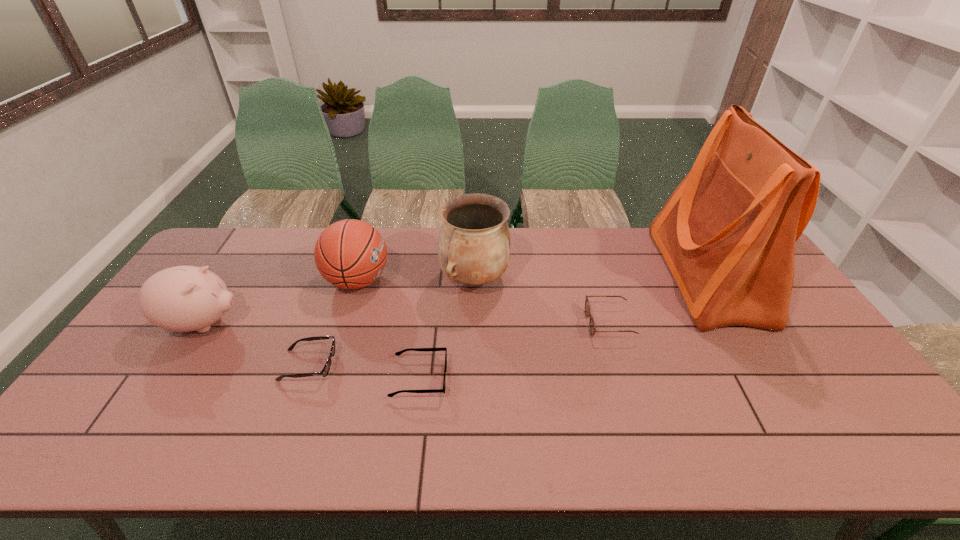
Where is `shopping bag at the far edge`? The width and height of the screenshot is (960, 540). shopping bag at the far edge is located at coordinates (727, 233).

Locate an element on the screen. The width and height of the screenshot is (960, 540). urn present at the far edge is located at coordinates (473, 245).

At what (x,y) coordinates should I click in order to perform the action: click on basketball present at the far edge. Please return your answer as a coordinate pair (x, y). Looking at the image, I should click on [x=351, y=254].

The width and height of the screenshot is (960, 540). I want to click on object located at the left edge, so click(x=183, y=298).

In order to click on object that is positioned at the right edge in this screenshot , I will do (727, 233).

Find the location of a particular element. The height and width of the screenshot is (540, 960). object that is at the far right corner is located at coordinates (727, 233).

I want to click on vacant area at the far edge of the desktop, so click(434, 231).

In order to click on vacant space at the near edge of the desktop in this screenshot , I will do `click(536, 448)`.

This screenshot has width=960, height=540. Find the location of `vacant space at the left edge`. vacant space at the left edge is located at coordinates (99, 411).

The width and height of the screenshot is (960, 540). Find the location of `vacant space at the near right corner of the desktop`. vacant space at the near right corner of the desktop is located at coordinates (840, 447).